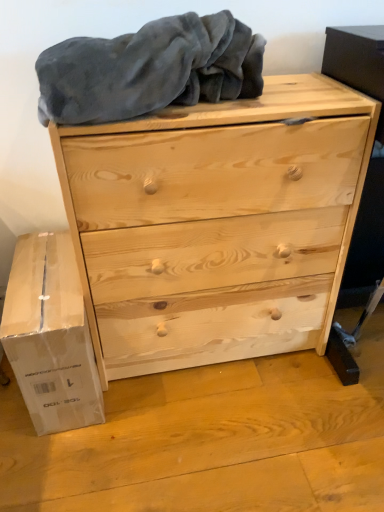
Question: Is white cardboard box at lower left facing towards natural wood chest of drawers at center?

Choices:
 (A) yes
 (B) no

Answer: (B)

Question: Is white cardboard box at lower left shorter than natural wood chest of drawers at center?

Choices:
 (A) yes
 (B) no

Answer: (A)

Question: Can you confirm if white cardboard box at lower left is thinner than natural wood chest of drawers at center?

Choices:
 (A) no
 (B) yes

Answer: (A)

Question: Considering the relative positions of white cardboard box at lower left and natural wood chest of drawers at center in the image provided, is white cardboard box at lower left in front of natural wood chest of drawers at center?

Choices:
 (A) no
 (B) yes

Answer: (A)

Question: Is white cardboard box at lower left touching natural wood chest of drawers at center?

Choices:
 (A) yes
 (B) no

Answer: (B)

Question: Is natural wood chest of drawers at center inside or outside of gray soft blanket at upper center?

Choices:
 (A) outside
 (B) inside

Answer: (A)

Question: Looking at the image, does natural wood chest of drawers at center seem bigger or smaller compared to gray soft blanket at upper center?

Choices:
 (A) small
 (B) big

Answer: (B)

Question: Does point (236, 189) appear closer or farther from the camera than point (160, 104)?

Choices:
 (A) farther
 (B) closer

Answer: (A)

Question: From a real-world perspective, is natural wood chest of drawers at center above or below gray soft blanket at upper center?

Choices:
 (A) below
 (B) above

Answer: (A)

Question: Which is correct: natural wood chest of drawers at center is inside white cardboard box at lower left, or outside of it?

Choices:
 (A) inside
 (B) outside

Answer: (B)

Question: In terms of width, does natural wood chest of drawers at center look wider or thinner when compared to white cardboard box at lower left?

Choices:
 (A) wide
 (B) thin

Answer: (B)

Question: Is natural wood chest of drawers at center in front of or behind white cardboard box at lower left in the image?

Choices:
 (A) behind
 (B) front

Answer: (B)

Question: Is natural wood chest of drawers at center taller or shorter than white cardboard box at lower left?

Choices:
 (A) tall
 (B) short

Answer: (A)

Question: Does point (24, 292) appear closer or farther from the camera than point (129, 92)?

Choices:
 (A) farther
 (B) closer

Answer: (A)

Question: Is white cardboard box at lower left taller or shorter than gray soft blanket at upper center?

Choices:
 (A) tall
 (B) short

Answer: (A)